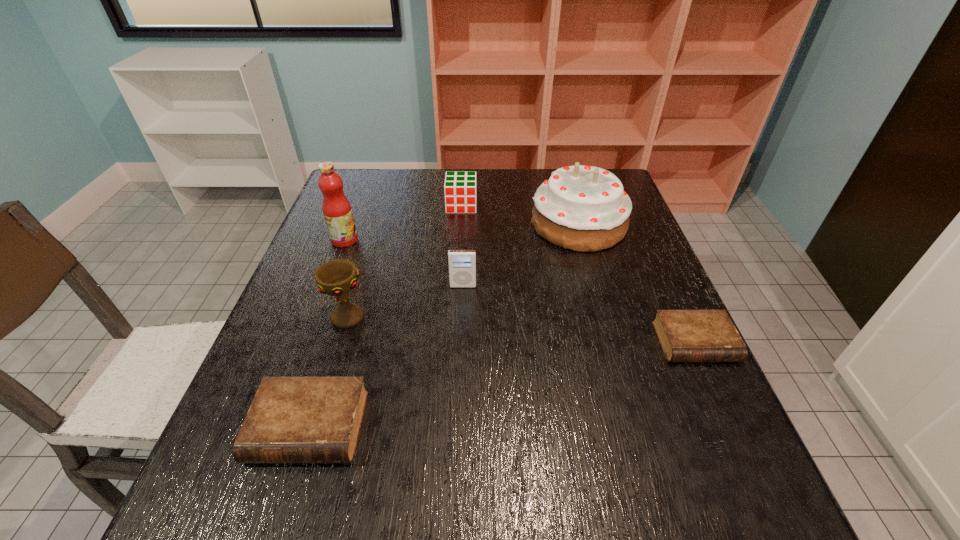
This screenshot has height=540, width=960. In the image, there is a desktop. In order to click on vacant space at the far left corner in this screenshot , I will do `click(372, 174)`.

Image resolution: width=960 pixels, height=540 pixels. In order to click on vacant region at the near left corner of the desktop in this screenshot , I will do `click(228, 443)`.

I want to click on vacant area that lies between the nearest object and the fruit juice, so click(326, 334).

In order to click on free spot between the nearer diary and the cube in this screenshot , I will do `click(385, 316)`.

You are a GUI agent. You are given a task and a screenshot of the screen. Output one action in this format:
    pyautogui.click(x=<x>, y=<y>)
    Task: Click on the unoccupied area between the fifth shortest object and the cube
    This screenshot has height=540, width=960.
    Given the screenshot: What is the action you would take?
    pyautogui.click(x=404, y=261)

Locate an element on the screen. The width and height of the screenshot is (960, 540). vacant area between the fruit juice and the cube is located at coordinates (403, 222).

The width and height of the screenshot is (960, 540). In order to click on free spot between the fourth nearest object and the cake in this screenshot , I will do `click(520, 255)`.

You are a GUI agent. You are given a task and a screenshot of the screen. Output one action in this format:
    pyautogui.click(x=<x>, y=<y>)
    Task: Click on the vacant space that's between the fourth shortest object and the cube
    Image resolution: width=960 pixels, height=540 pixels.
    Given the screenshot: What is the action you would take?
    pyautogui.click(x=462, y=246)

The width and height of the screenshot is (960, 540). Identify the location of empty space that is in between the third tallest object and the fourth nearest object. (405, 301).

Locate an element on the screen. free point between the left diary and the cube is located at coordinates (385, 316).